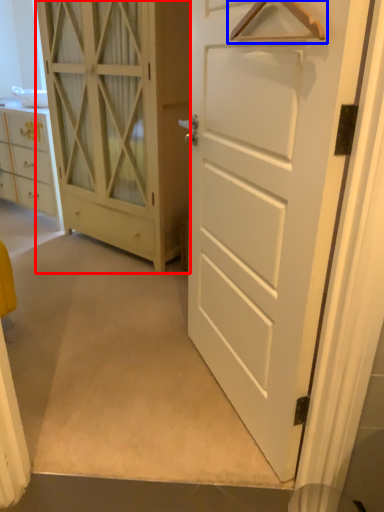
Question: Among these objects, which one is farthest to the camera, door (highlighted by a red box) or hanger (highlighted by a blue box)?

Choices:
 (A) door
 (B) hanger

Answer: (A)